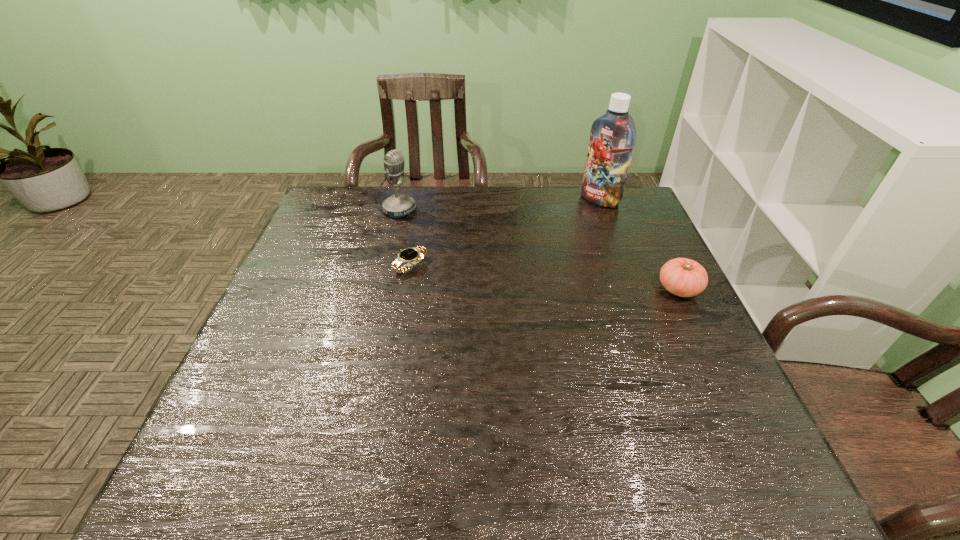
At what (x,y) coordinates should I click in order to perform the action: click on vacant space on the desktop that is between the shortest object and the second shortest object and is positioned on the front-facing side of the second tallest object. Please return your answer as a coordinate pair (x, y). The width and height of the screenshot is (960, 540). Looking at the image, I should click on (512, 274).

This screenshot has width=960, height=540. Identify the location of vacant space on the desktop that is between the watch and the second shortest object and is positioned on the front label of the second object from right to left. (507, 274).